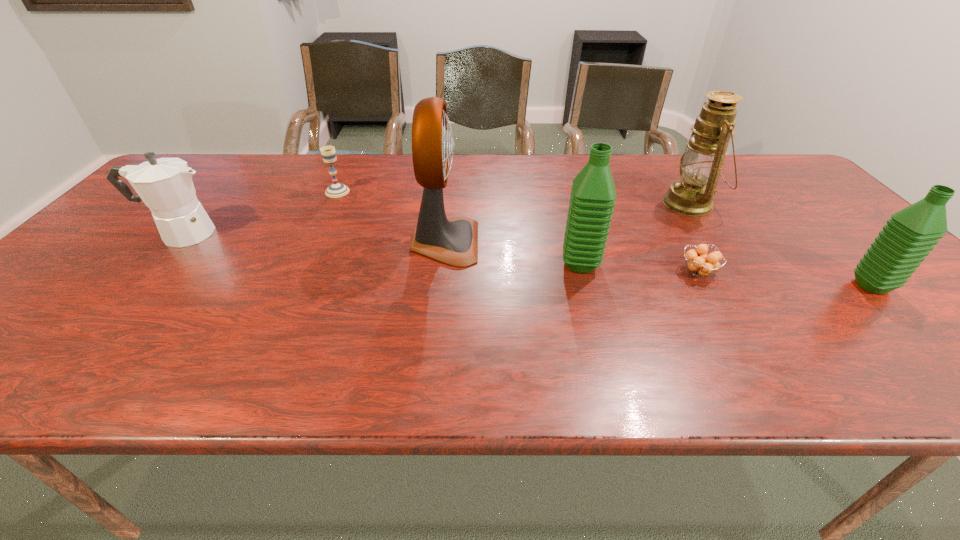
Please point a spot to add another water bottle on the left. Please provide its 2D coordinates. Your answer should be formatted as a tuple, i.e. [(x, y)], where the tuple contains the x and y coordinates of a point satisfying the conditions above.

[(319, 245)]